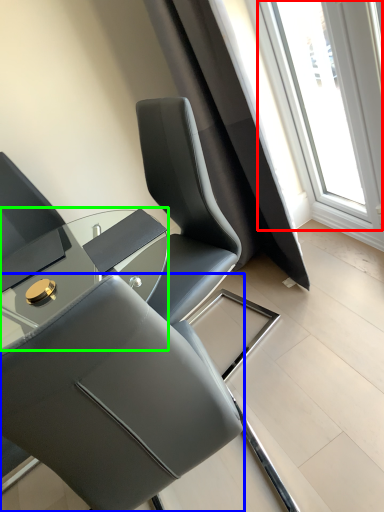
Question: Which object is positioned farthest from window (highlighted by a red box)? Select from chair (highlighted by a blue box) and table (highlighted by a green box).

Choices:
 (A) chair
 (B) table

Answer: (A)